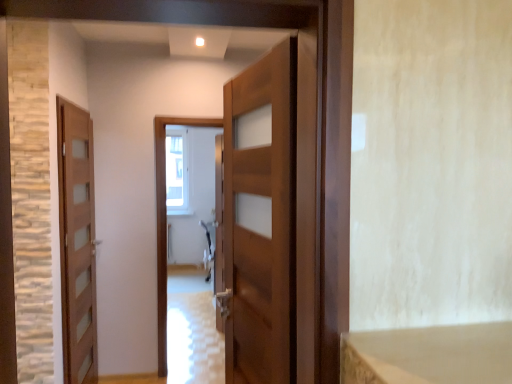
Question: Is wooden door at center, which ranks as the 1th door in front-to-back order, with glossy wooden door at center?

Choices:
 (A) no
 (B) yes

Answer: (A)

Question: Can you confirm if wooden door at center, positioned as the first door in right-to-left order, is positioned to the left of glossy wooden door at center?

Choices:
 (A) yes
 (B) no

Answer: (B)

Question: Is the depth of wooden door at center, marked as the 2th door in a back-to-front arrangement, greater than that of glossy wooden door at center?

Choices:
 (A) no
 (B) yes

Answer: (A)

Question: Is wooden door at center, marked as the 2th door in a back-to-front arrangement, facing away from glossy wooden door at center?

Choices:
 (A) no
 (B) yes

Answer: (A)

Question: Is wooden door at center, marked as the 2th door in a left-to-right arrangement, bigger than glossy wooden door at center?

Choices:
 (A) no
 (B) yes

Answer: (A)

Question: From a real-world perspective, is glossy wooden door at center physically located above or below wooden door at left, marked as the first door in a back-to-front arrangement?

Choices:
 (A) above
 (B) below

Answer: (B)

Question: Is point (175, 322) positioned closer to the camera than point (79, 213)?

Choices:
 (A) closer
 (B) farther

Answer: (B)

Question: In the image, is glossy wooden door at center on the left side or the right side of wooden door at left, which ranks as the first door in left-to-right order?

Choices:
 (A) left
 (B) right

Answer: (B)

Question: Is glossy wooden door at center taller or shorter than wooden door at left, acting as the 2th door starting from the right?

Choices:
 (A) short
 (B) tall

Answer: (A)

Question: From a real-world perspective, is wooden door at left, which is the 2th door in front-to-back order, physically located above or below glossy wooden door at center?

Choices:
 (A) below
 (B) above

Answer: (B)

Question: In terms of width, does wooden door at left, acting as the 2th door starting from the right, look wider or thinner when compared to glossy wooden door at center?

Choices:
 (A) wide
 (B) thin

Answer: (B)

Question: From the image's perspective, is wooden door at left, which is the 2th door in front-to-back order, located above or below glossy wooden door at center?

Choices:
 (A) below
 (B) above

Answer: (B)

Question: In terms of height, does wooden door at left, which is the 2th door in front-to-back order, look taller or shorter compared to glossy wooden door at center?

Choices:
 (A) short
 (B) tall

Answer: (B)

Question: Is point (73, 367) positioned closer to the camera than point (172, 177)?

Choices:
 (A) farther
 (B) closer

Answer: (B)

Question: Based on their sizes in the image, would you say wooden door at left, acting as the 2th door starting from the right, is bigger or smaller than clear glass window at center?

Choices:
 (A) big
 (B) small

Answer: (A)